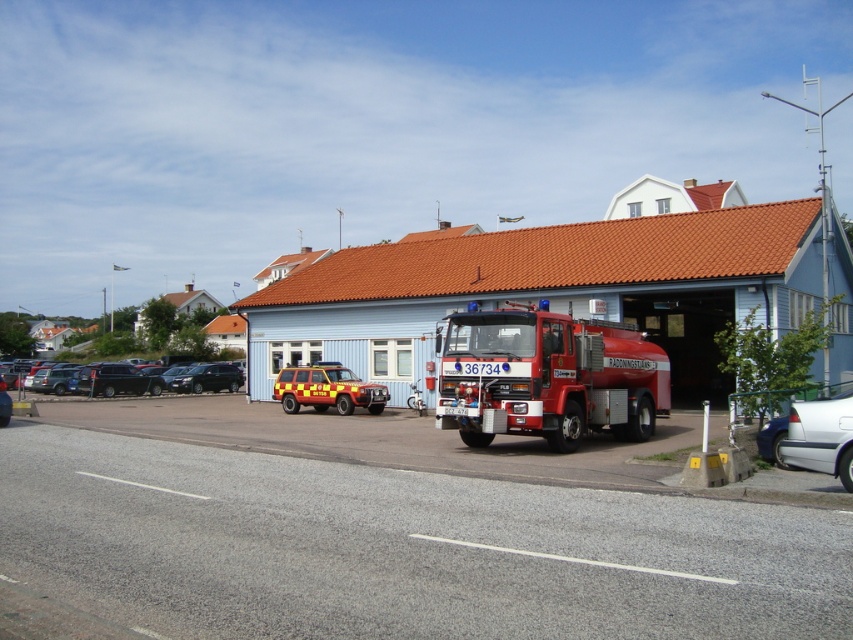
Based on the photo, you are a firefighter who needs to choose a vehicle to respond to an emergency call. The shiny red fire truck at center is available, as well as the silver metallic sedan at lower right. Which vehicle should you choose and why?

You should choose the shiny red fire truck at center because it is specifically designed for firefighting operations and equipped with necessary tools, whereas the silver metallic sedan at lower right is a smaller vehicle and not suitable for emergency response tasks.